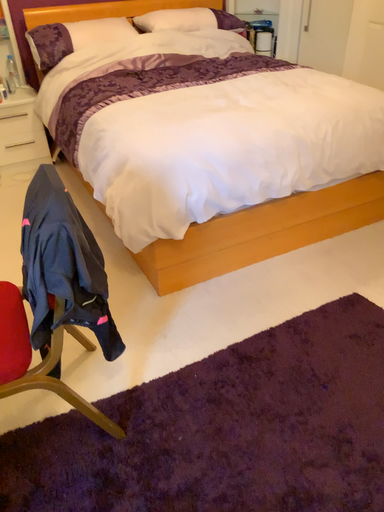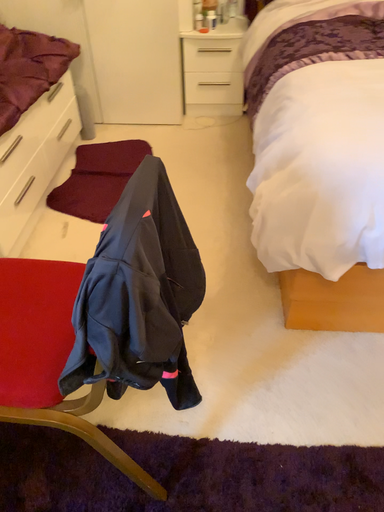
Question: Which way did the camera rotate in the video?

Choices:
 (A) rotated left
 (B) rotated right

Answer: (A)